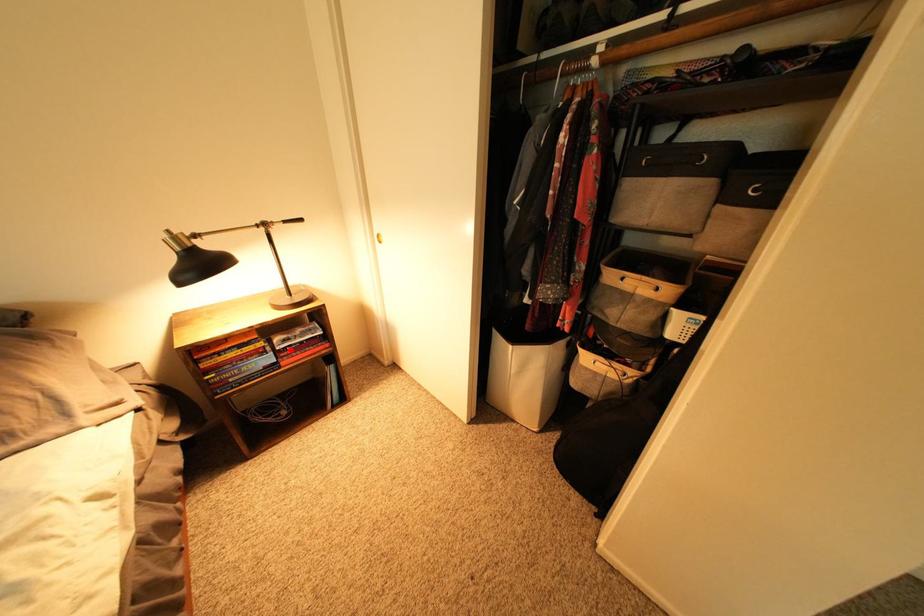
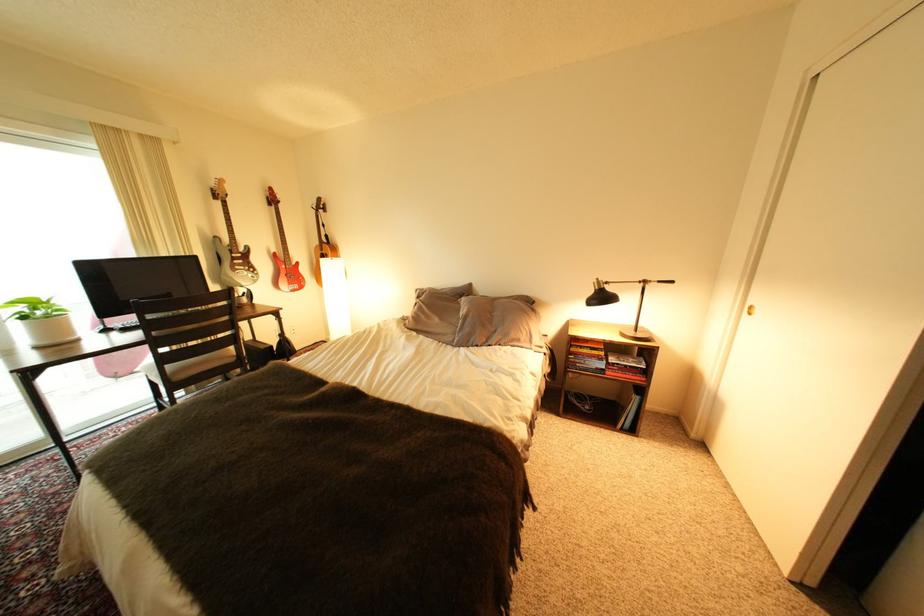
Question: I am providing you with two images of the same scene from different viewpoints. Given a red point in image1, look at the same physical point in image2. Is it:

Choices:
 (A) Closer to the viewpoint
 (B) Farther from the viewpoint

Answer: (B)